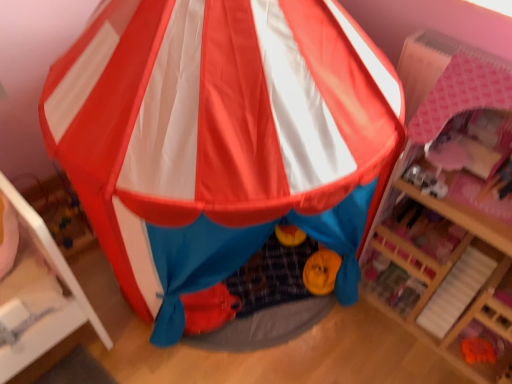
From the picture: What is the approximate height of pink wood dollhouse at right?

The height of pink wood dollhouse at right is 89.60 centimeters.

What do you see at coordinates (446, 293) in the screenshot? This screenshot has width=512, height=384. I see `pink wood dollhouse at right` at bounding box center [446, 293].

Image resolution: width=512 pixels, height=384 pixels. I want to click on pink wood dollhouse at right, so click(446, 293).

The height and width of the screenshot is (384, 512). Describe the element at coordinates (221, 139) in the screenshot. I see `matte plastic tent at center` at that location.

Where is `matte plastic tent at center`? matte plastic tent at center is located at coordinates (221, 139).

What is the approximate height of matte plastic tent at center?

matte plastic tent at center is 1.19 meters tall.

Where is `pink wood dollhouse at right`? This screenshot has width=512, height=384. pink wood dollhouse at right is located at coordinates (446, 293).

Visually, is matte plastic tent at center positioned to the left or to the right of pink wood dollhouse at right?

From the image, it's evident that matte plastic tent at center is to the left of pink wood dollhouse at right.

Which object is closer to the camera, matte plastic tent at center or pink wood dollhouse at right?

Positioned in front is matte plastic tent at center.

Is point (298, 210) closer to viewer compared to point (453, 311)?

Yes, it is.

From the image's perspective, which object appears higher, matte plastic tent at center or pink wood dollhouse at right?

matte plastic tent at center, from the image's perspective.

From a real-world perspective, who is located lower, matte plastic tent at center or pink wood dollhouse at right?

In real-world perspective, pink wood dollhouse at right is lower.

Between matte plastic tent at center and pink wood dollhouse at right, which one has smaller width?

With smaller width is pink wood dollhouse at right.

Which of these two, matte plastic tent at center or pink wood dollhouse at right, stands taller?

Standing taller between the two is matte plastic tent at center.

Is matte plastic tent at center bigger than pink wood dollhouse at right?

Yes, matte plastic tent at center is bigger than pink wood dollhouse at right.

Can we say matte plastic tent at center lies outside pink wood dollhouse at right?

Yes, matte plastic tent at center is located beyond the bounds of pink wood dollhouse at right.

Is matte plastic tent at center beside pink wood dollhouse at right?

There is a gap between matte plastic tent at center and pink wood dollhouse at right.

Is matte plastic tent at center facing away from pink wood dollhouse at right?

No.

Looking at this image, how different are the orientations of matte plastic tent at center and pink wood dollhouse at right in degrees?

49.4 degrees separate the facing orientations of matte plastic tent at center and pink wood dollhouse at right.

Where is `tent that is above the pink wood dollhouse at right (from the image's perspective)`? Image resolution: width=512 pixels, height=384 pixels. tent that is above the pink wood dollhouse at right (from the image's perspective) is located at coordinates (221, 139).

Which is more to the left, pink wood dollhouse at right or matte plastic tent at center?

matte plastic tent at center is more to the left.

Is the depth of pink wood dollhouse at right greater than that of matte plastic tent at center?

That is True.

Does point (442, 330) come behind point (159, 312)?

Yes, point (442, 330) is farther from viewer.

From the image's perspective, which one is positioned lower, pink wood dollhouse at right or matte plastic tent at center?

pink wood dollhouse at right, from the image's perspective.

From a real-world perspective, which is physically above, pink wood dollhouse at right or matte plastic tent at center?

matte plastic tent at center, from a real-world perspective.

Can you confirm if pink wood dollhouse at right is thinner than matte plastic tent at center?

Correct, the width of pink wood dollhouse at right is less than that of matte plastic tent at center.

Considering the sizes of objects pink wood dollhouse at right and matte plastic tent at center in the image provided, who is taller, pink wood dollhouse at right or matte plastic tent at center?

Standing taller between the two is matte plastic tent at center.

Between pink wood dollhouse at right and matte plastic tent at center, which one has smaller size?

pink wood dollhouse at right.

Is pink wood dollhouse at right located outside matte plastic tent at center?

Yes, pink wood dollhouse at right is outside of matte plastic tent at center.

Is pink wood dollhouse at right positioned far away from matte plastic tent at center?

No, pink wood dollhouse at right is in close proximity to matte plastic tent at center.

Could you tell me if pink wood dollhouse at right is turned towards matte plastic tent at center?

No, pink wood dollhouse at right is not facing towards matte plastic tent at center.

How different are the orientations of pink wood dollhouse at right and matte plastic tent at center in degrees?

The angle between the facing direction of pink wood dollhouse at right and the facing direction of matte plastic tent at center is 49.4 degrees.

Looking at this image, how much distance is there between pink wood dollhouse at right and matte plastic tent at center?

17.61 inches.

Identify the location of tent lying on the left of pink wood dollhouse at right. click(x=221, y=139).

Identify the location of tent in front of the pink wood dollhouse at right. The image size is (512, 384). (221, 139).

Locate an element on the screen. This screenshot has width=512, height=384. shelf that is under the matte plastic tent at center (from a real-world perspective) is located at coordinates (446, 293).